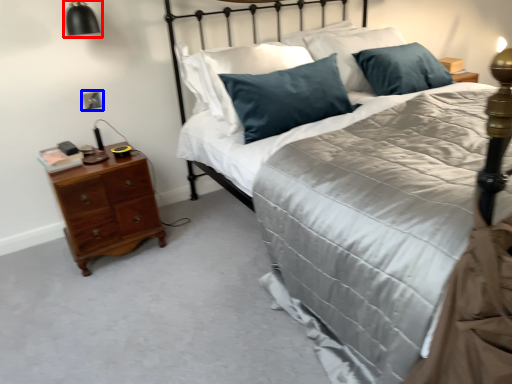
Question: Which object is further to the camera taking this photo, bedside lamp (highlighted by a red box) or electric outlet (highlighted by a blue box)?

Choices:
 (A) bedside lamp
 (B) electric outlet

Answer: (B)